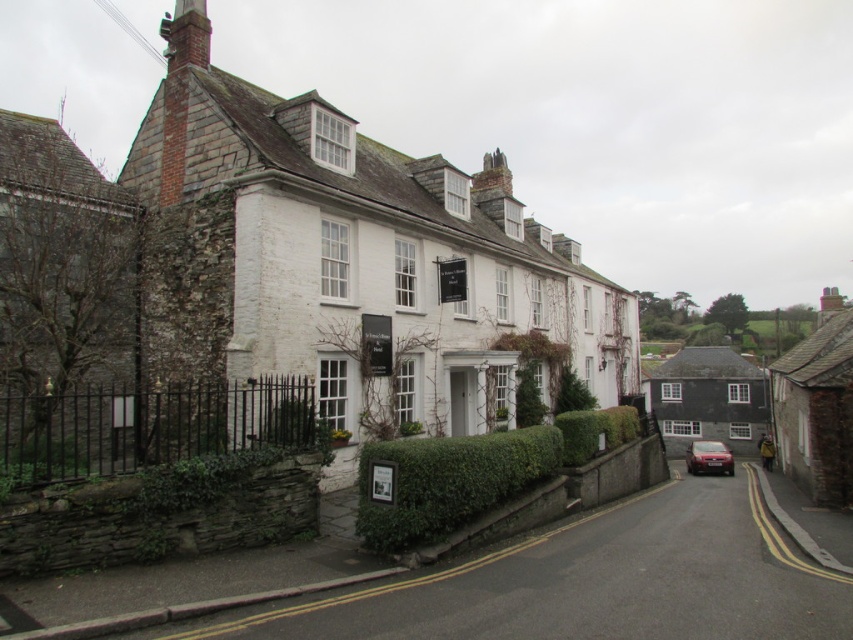
Question: Does green leafy hedge at lower center have a smaller size compared to metallic red car at lower right?

Choices:
 (A) no
 (B) yes

Answer: (B)

Question: Can you confirm if green leafy hedge at lower center is positioned to the left of green leafy hedge at center?

Choices:
 (A) no
 (B) yes

Answer: (B)

Question: Which point is closer to the camera?

Choices:
 (A) green leafy hedge at lower center
 (B) metallic red car at lower right
 (C) green leafy hedge at center

Answer: (A)

Question: Does green leafy hedge at center come behind metallic red car at lower right?

Choices:
 (A) no
 (B) yes

Answer: (A)

Question: Which point appears closest to the camera in this image?

Choices:
 (A) (x=456, y=502)
 (B) (x=585, y=422)
 (C) (x=724, y=467)

Answer: (A)

Question: Which point appears farthest from the camera in this image?

Choices:
 (A) (608, 449)
 (B) (495, 449)
 (C) (692, 449)

Answer: (C)